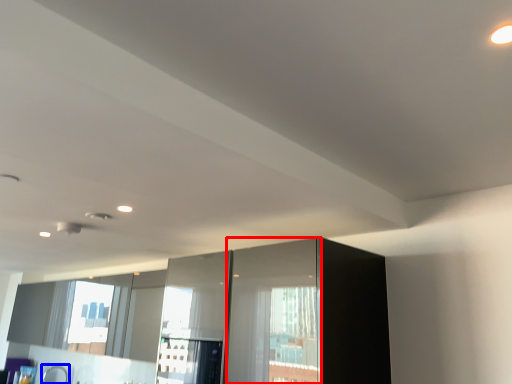
Question: Which object is further to the camera taking this photo, screen door (highlighted by a red box) or faucet (highlighted by a blue box)?

Choices:
 (A) screen door
 (B) faucet

Answer: (B)